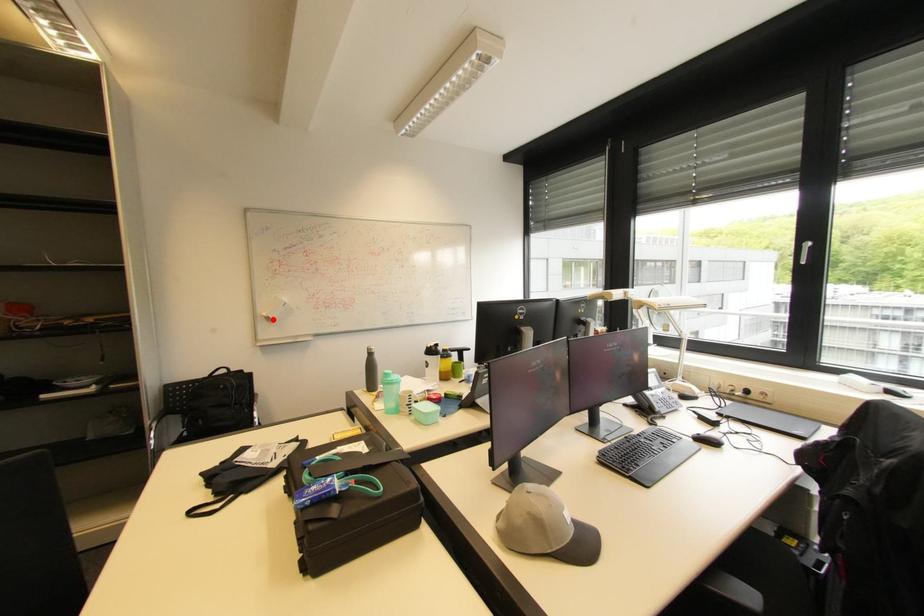
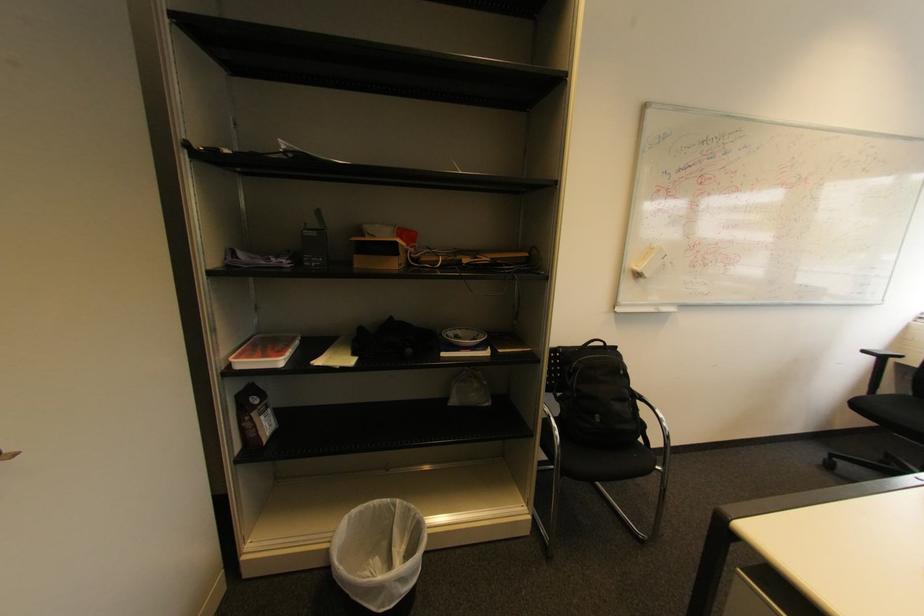
Question: I am providing you with two images of the same scene from different viewpoints. Given a red point in image1, look at the same physical point in image2. Is it:

Choices:
 (A) Closer to the viewpoint
 (B) Farther from the viewpoint

Answer: (A)